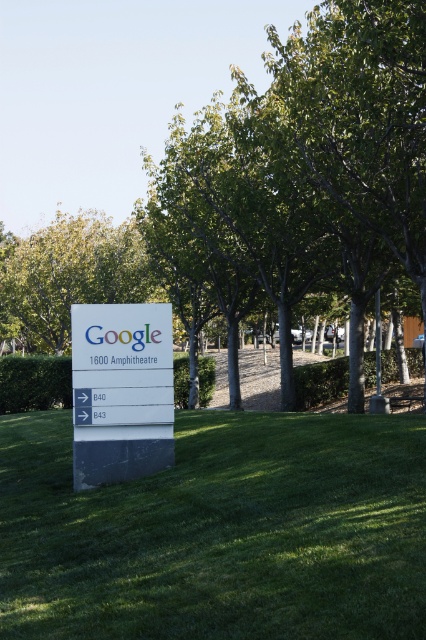
Which is behind, point (135, 468) or point (40, 300)?

The point (40, 300) is behind.

Between white plastic sign at center and green leafy tree at upper center, which one appears on the left side from the viewer's perspective?

Positioned to the left is green leafy tree at upper center.

Who is more forward, [135,472] or [74,224]?

Positioned in front is point [135,472].

You are a GUI agent. You are given a task and a screenshot of the screen. Output one action in this format:
    pyautogui.click(x=<x>, y=<y>)
    Task: Click on the white plastic sign at center
    The image size is (426, 640).
    Given the screenshot: What is the action you would take?
    pyautogui.click(x=120, y=392)

Who is positioned more to the right, green grass at center or green leafy tree at center?

green leafy tree at center

Where is `green grass at center`? The height and width of the screenshot is (640, 426). green grass at center is located at coordinates (219, 532).

Between point (158, 628) and point (241, 186), which one is positioned in front?

Point (158, 628) is in front.

At what (x,y) coordinates should I click in order to perform the action: click on green grass at center. Please return your answer as a coordinate pair (x, y). Image resolution: width=426 pixels, height=640 pixels. Looking at the image, I should click on (219, 532).

Does green grass at center have a greater width compared to white plastic sign at center?

Yes.

Can you confirm if green grass at center is shorter than white plastic sign at center?

Indeed, green grass at center has a lesser height compared to white plastic sign at center.

Does point (26, 525) come closer to viewer compared to point (89, 384)?

Yes, it is.

At what (x,y) coordinates should I click in order to perform the action: click on green grass at center. Please return your answer as a coordinate pair (x, y). Looking at the image, I should click on (219, 532).